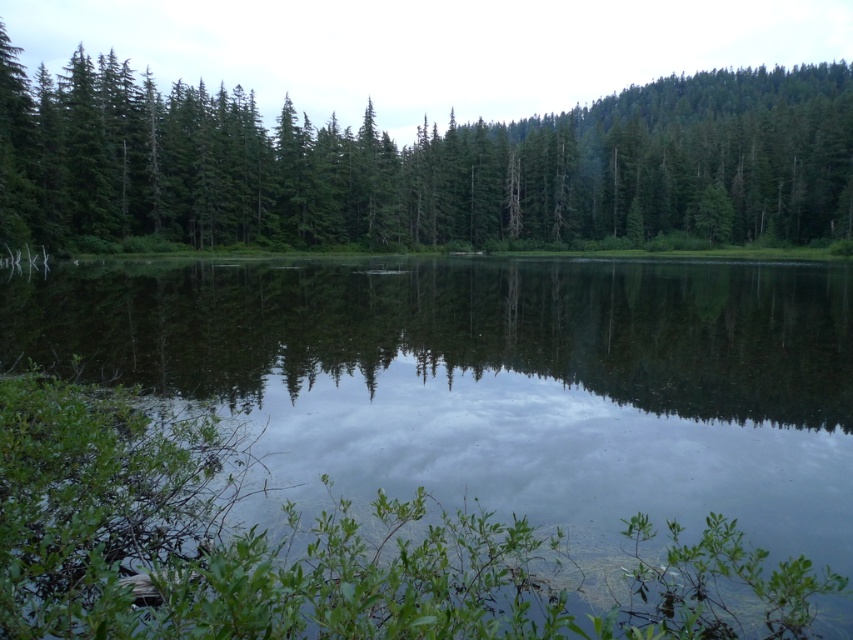
Question: Which point is closer to the camera?

Choices:
 (A) transparent water at center
 (B) green matte trees at upper center

Answer: (A)

Question: Is transparent water at center wider than green matte trees at upper center?

Choices:
 (A) no
 (B) yes

Answer: (A)

Question: Among these points, which one is nearest to the camera?

Choices:
 (A) (463, 227)
 (B) (416, 298)

Answer: (B)

Question: Does transparent water at center have a larger size compared to green matte trees at upper center?

Choices:
 (A) yes
 (B) no

Answer: (B)

Question: Considering the relative positions of transparent water at center and green matte trees at upper center in the image provided, where is transparent water at center located with respect to green matte trees at upper center?

Choices:
 (A) below
 (B) above

Answer: (A)